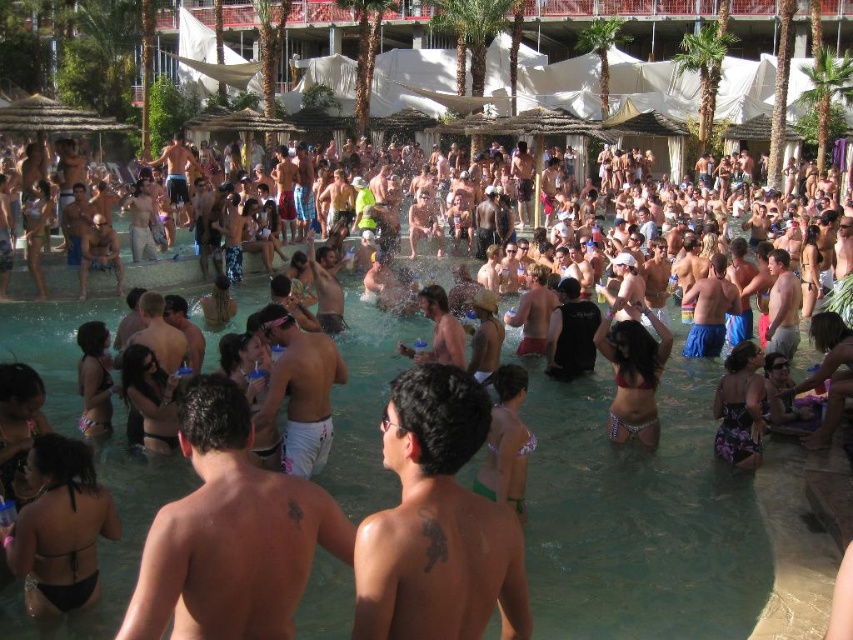
You are a photographer trying to capture a candid shot of the white cotton shorts at center and the multicolored bikini at center. Since you want to ensure both are visible in the frame, which one should you focus on first to avoid blurring due to their height difference?

The white cotton shorts at center has a lesser height compared to the multicolored bikini at center. Therefore, you should focus on the multicolored bikini at center first as it is taller and might require more attention to capture details without blurring.

You are a photographer at the pool party trying to capture a candid shot of both the dark skin tattooed back at center and the white cotton shorts at center. Given that your camera has a maximum focus range of 45 feet, will you be able to get both subjects in focus at the same time?

The dark skin tattooed back at center and the white cotton shorts at center are 46.17 feet apart from each other. Since the camera can only focus up to 45 feet, the distance between them exceeds the maximum focus range. Therefore, you cannot get both subjects in focus simultaneously.

You are a photographer trying to capture a candid shot of the white cotton shorts at center and the multicolored bikini at center. Since you want to focus on the shorts, which object should you position closer to the front of your camera frame?

The white cotton shorts at center is positioned under the multicolored bikini at center, so to focus on the shorts, you should position the white cotton shorts at center closer to the front of your camera frame.